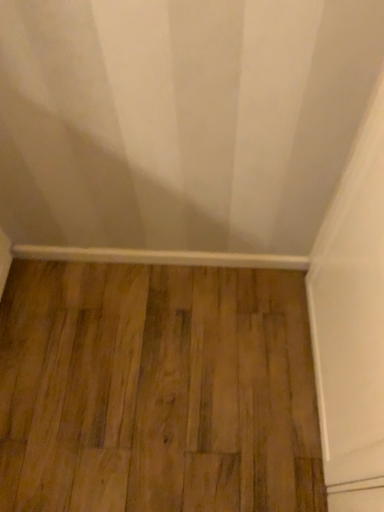
Question: Is brown wood flooring at center to the right of white smooth baseboard at bottom from the viewer's perspective?

Choices:
 (A) yes
 (B) no

Answer: (A)

Question: Is brown wood flooring at center not inside white smooth baseboard at bottom?

Choices:
 (A) yes
 (B) no

Answer: (A)

Question: Considering the relative sizes of brown wood flooring at center and white smooth baseboard at bottom in the image provided, is brown wood flooring at center thinner than white smooth baseboard at bottom?

Choices:
 (A) yes
 (B) no

Answer: (B)

Question: From the image's perspective, does brown wood flooring at center appear lower than white smooth baseboard at bottom?

Choices:
 (A) no
 (B) yes

Answer: (B)

Question: Is brown wood flooring at center taller than white smooth baseboard at bottom?

Choices:
 (A) yes
 (B) no

Answer: (B)

Question: Is brown wood flooring at center next to white smooth baseboard at bottom?

Choices:
 (A) yes
 (B) no

Answer: (B)

Question: Is white smooth baseboard at bottom shorter than brown wood flooring at center?

Choices:
 (A) no
 (B) yes

Answer: (A)

Question: Considering the relative positions of white smooth baseboard at bottom and brown wood flooring at center in the image provided, is white smooth baseboard at bottom to the left of brown wood flooring at center from the viewer's perspective?

Choices:
 (A) yes
 (B) no

Answer: (A)

Question: From the image's perspective, is white smooth baseboard at bottom on brown wood flooring at center?

Choices:
 (A) yes
 (B) no

Answer: (A)

Question: Can you confirm if white smooth baseboard at bottom is wider than brown wood flooring at center?

Choices:
 (A) yes
 (B) no

Answer: (B)

Question: Are white smooth baseboard at bottom and brown wood flooring at center far apart?

Choices:
 (A) no
 (B) yes

Answer: (A)

Question: Can you confirm if white smooth baseboard at bottom is taller than brown wood flooring at center?

Choices:
 (A) yes
 (B) no

Answer: (A)

Question: Which is correct: brown wood flooring at center is inside white smooth baseboard at bottom, or outside of it?

Choices:
 (A) inside
 (B) outside

Answer: (B)